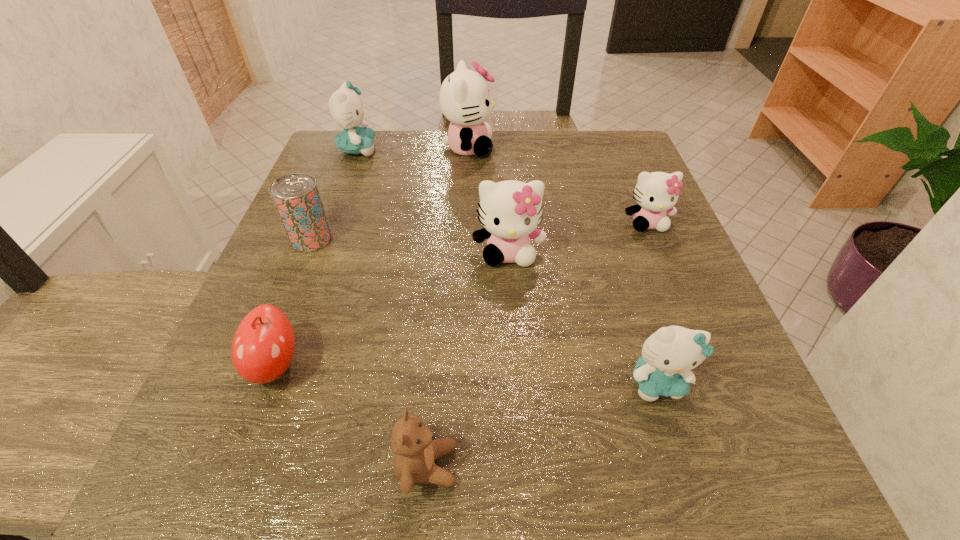
The height and width of the screenshot is (540, 960). Find the location of `brown teddy bear`. brown teddy bear is located at coordinates (412, 442).

Identify the location of teddy bear. The width and height of the screenshot is (960, 540). (412, 442).

The height and width of the screenshot is (540, 960). Find the location of `vacant space located 0.340m on the front-facing side of the tallest kitten`. vacant space located 0.340m on the front-facing side of the tallest kitten is located at coordinates (633, 148).

Locate an element on the screen. The image size is (960, 540). free space located on the face of the farther blue kitten is located at coordinates (516, 149).

You are a GUI agent. You are given a task and a screenshot of the screen. Output one action in this format:
    pyautogui.click(x=<x>, y=<y>)
    Task: Click on the vacant region located on the front-facing side of the second biggest white kitten
    
    Given the screenshot: What is the action you would take?
    pyautogui.click(x=513, y=325)

Locate an element on the screen. vacant space located on the right of the beer can is located at coordinates (489, 239).

Image resolution: width=960 pixels, height=540 pixels. I want to click on free space located on the front-facing side of the smallest white kitten, so [x=664, y=264].

The image size is (960, 540). I want to click on free spot located on the face of the smaller blue kitten, so click(x=691, y=490).

At what (x,y) coordinates should I click in order to perform the action: click on free spot located 0.340m on the right of the apple. Please return your answer as a coordinate pair (x, y). This screenshot has height=540, width=960. Looking at the image, I should click on (534, 364).

Identify the location of vacant space located on the front-facing side of the nearest object. (609, 465).